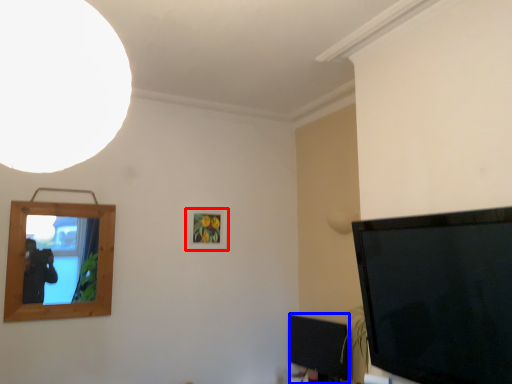
Question: Which object appears closest to the camera in this image, picture frame (highlighted by a red box) or television (highlighted by a blue box)?

Choices:
 (A) picture frame
 (B) television

Answer: (B)